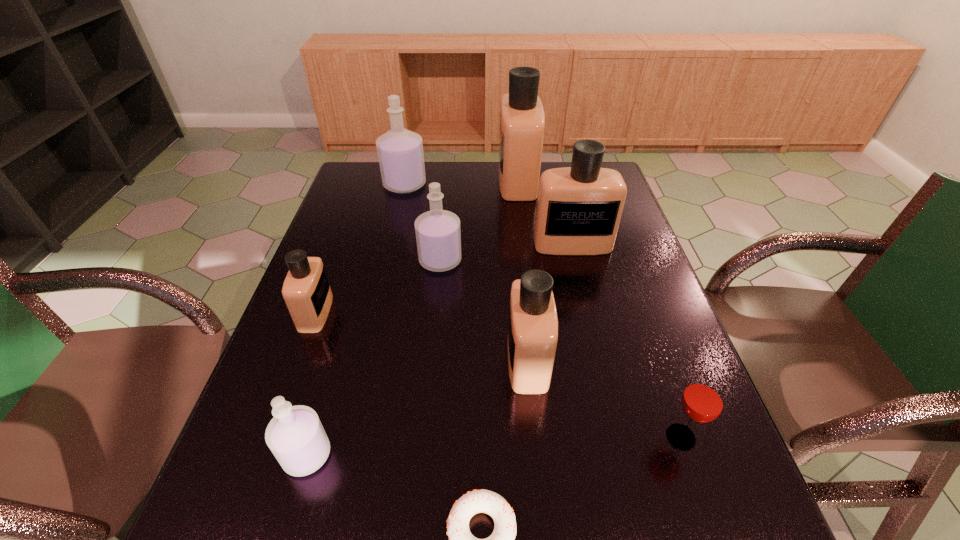
Where is `free space at the right edge of the desktop`? The width and height of the screenshot is (960, 540). free space at the right edge of the desktop is located at coordinates (607, 295).

This screenshot has height=540, width=960. I want to click on vacant space at the far left corner, so click(x=378, y=180).

Locate an element on the screen. The height and width of the screenshot is (540, 960). free space at the near left corner is located at coordinates (265, 533).

The height and width of the screenshot is (540, 960). Find the location of `free space at the far right corner`. free space at the far right corner is located at coordinates (570, 163).

In the image, there is a desktop. At what (x,y) coordinates should I click in order to perform the action: click on free space at the near right corner. Please return your answer as a coordinate pair (x, y). This screenshot has height=540, width=960. Looking at the image, I should click on (671, 516).

What are the coordinates of `free space between the biggest beige perfume and the second biggest purple perfume` in the screenshot? It's located at 479,220.

The height and width of the screenshot is (540, 960). What are the coordinates of `free space between the leftmost beige perfume and the second smallest beige perfume` in the screenshot? It's located at (421, 336).

Image resolution: width=960 pixels, height=540 pixels. Identify the location of free space between the third nearest beige perfume and the red glass. point(627,340).

Find the location of a particular element. This screenshot has width=960, height=540. vacant space in between the farthest beige perfume and the rightmost purple perfume is located at coordinates (479, 220).

Identify the location of vacant area that lies between the biggest purple perfume and the leftmost object. Image resolution: width=960 pixels, height=540 pixels. (360, 248).